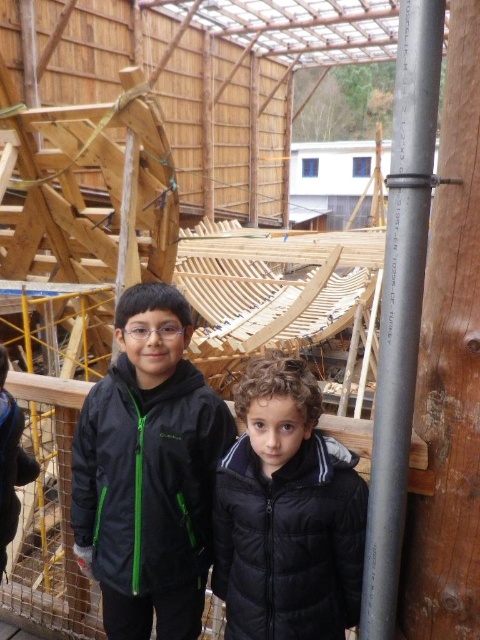
You are a tailor measuring jackets for two children in a boat workshop. You need to hang the black matte jacket at center and the black puffy jacket at center on a rack. Which jacket should you hang higher on the rack to accommodate their different heights?

The black matte jacket at center should be hung higher on the rack because it has a greater height compared to the black puffy jacket at center.

You are a photographer trying to capture both the black matte jacket at center and the black puffy jacket at center in a single shot. Since you want to focus on the lower part of the scene, which jacket should you adjust your camera angle to ensure it is fully visible?

The black puffy jacket at center is below the black matte jacket at center. To focus on the lower part and ensure the black puffy jacket at center is fully visible, adjust the camera angle downward.

You are a drone operator trying to capture a photo of the black puffy jacket at center. The drone has a camera with a field of view that can only focus on objects within a 0.1 radius around the point specified. What coordinates should you input to ensure the jacket is in the center of the photo?

You should input coordinates at point (289,541) to ensure the black puffy jacket at center is in the center of the photo since that is its exact location.